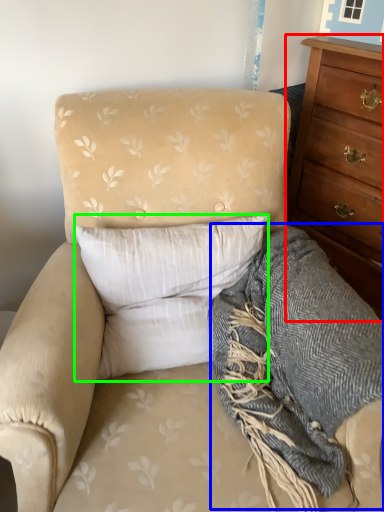
Question: Based on their relative distances, which object is farther from chest of drawers (highlighted by a red box)? Choose from blanket (highlighted by a blue box) and pillow (highlighted by a green box).

Choices:
 (A) blanket
 (B) pillow

Answer: (B)